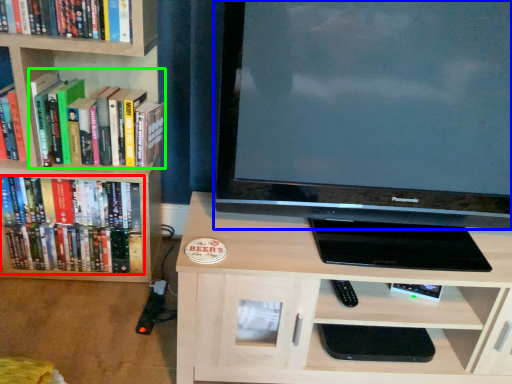
Question: Estimate the real-world distances between objects in this image. Which object is farther from book (highlighted by a red box), television (highlighted by a blue box) or book (highlighted by a green box)?

Choices:
 (A) television
 (B) book

Answer: (A)